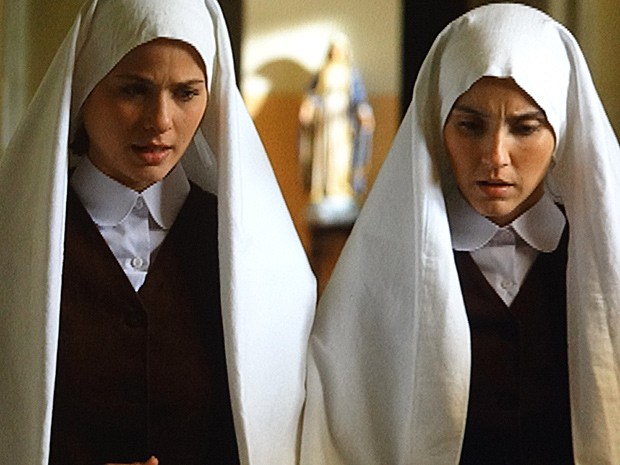
Where is `virgin mary figurine in the background`? Image resolution: width=620 pixels, height=465 pixels. virgin mary figurine in the background is located at coordinates (343, 123).